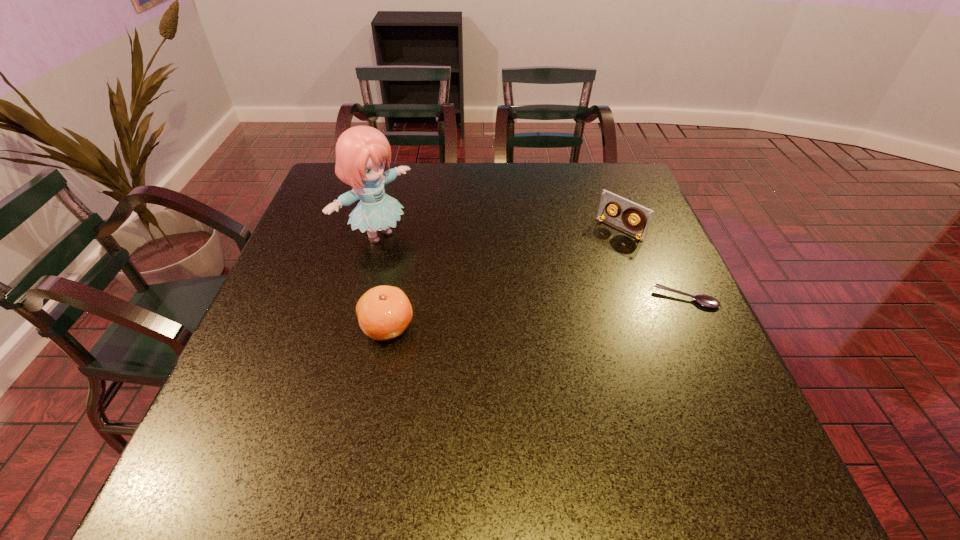
The width and height of the screenshot is (960, 540). In order to click on the closest object to the videotape in this screenshot , I will do `click(705, 300)`.

Identify which object is the third nearest to the videotape. Please provide its 2D coordinates. Your answer should be formatted as a tuple, i.e. [(x, y)], where the tuple contains the x and y coordinates of a point satisfying the conditions above.

[(384, 312)]

The height and width of the screenshot is (540, 960). What are the coordinates of `blank area in the image that satisfies the following two spatial constraints: 1. on the back side of the soupspoon; 2. on the left side of the clementine` in the screenshot? It's located at (393, 299).

Locate an element on the screen. This screenshot has height=540, width=960. vacant space that satisfies the following two spatial constraints: 1. on the front side of the videotape; 2. on the left side of the shortest object is located at coordinates (645, 299).

Find the location of a particular element. This screenshot has height=540, width=960. vacant space that satisfies the following two spatial constraints: 1. on the back side of the tallest object; 2. on the left side of the videotape is located at coordinates click(379, 229).